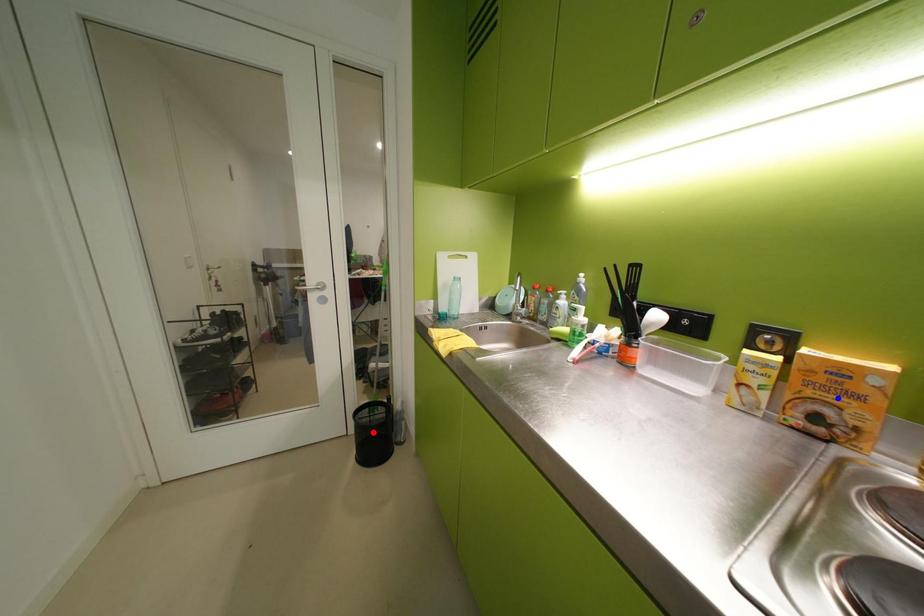
Question: Two points are marked on the image. Which point is closer to the camera?

Choices:
 (A) Blue point is closer.
 (B) Red point is closer.

Answer: (A)